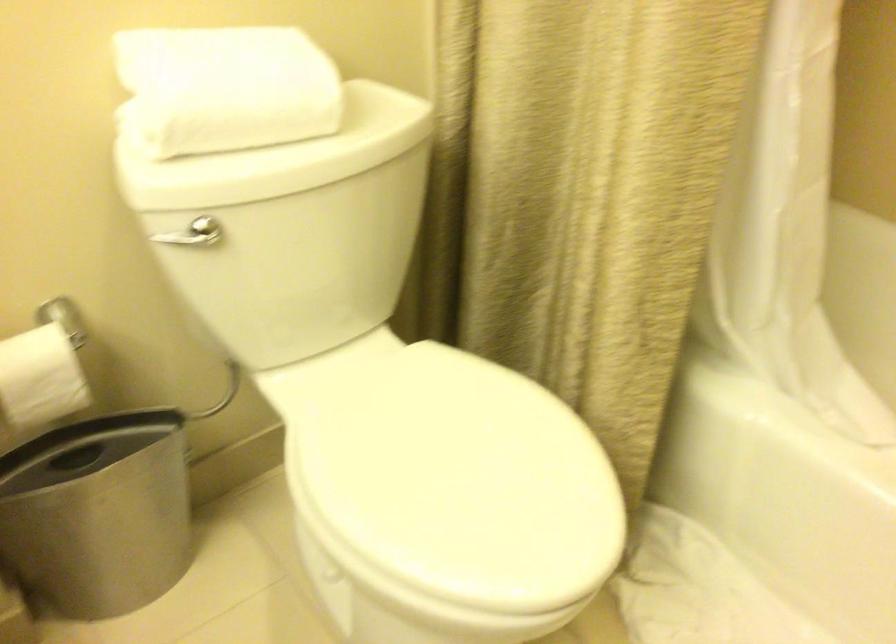
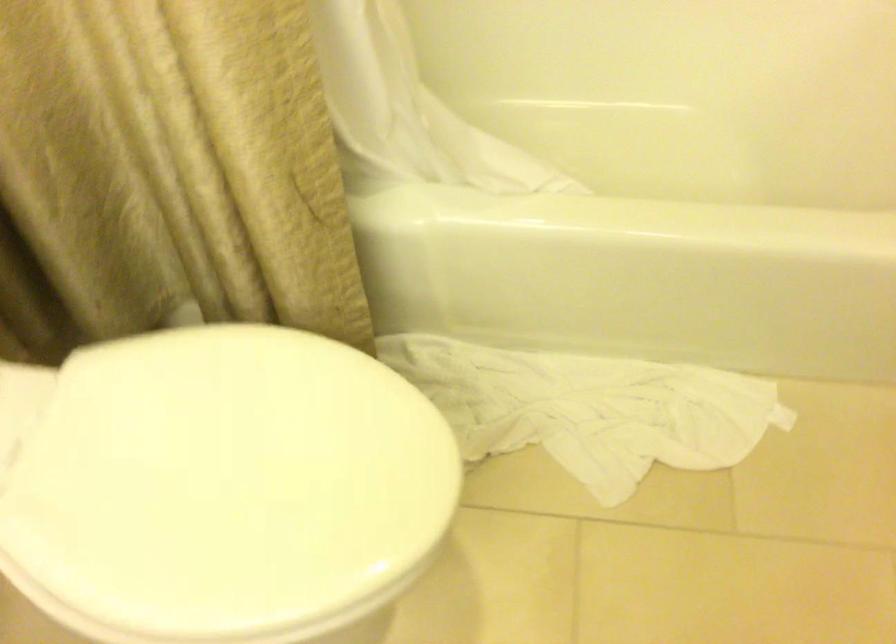
The images are taken continuously from a first-person perspective. In which direction is your viewpoint rotating?

The camera's rotation is toward right-down.